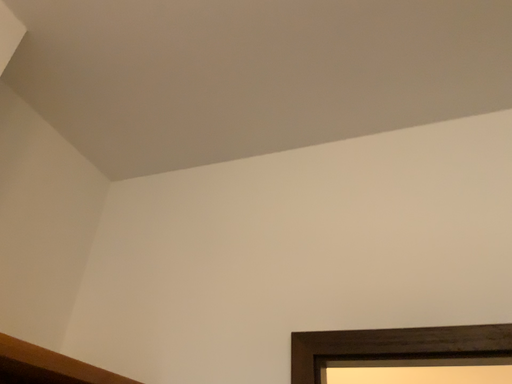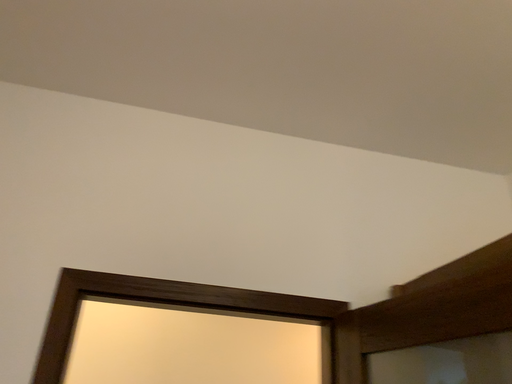
Question: Which way did the camera rotate in the video?

Choices:
 (A) rotated right
 (B) rotated left

Answer: (A)